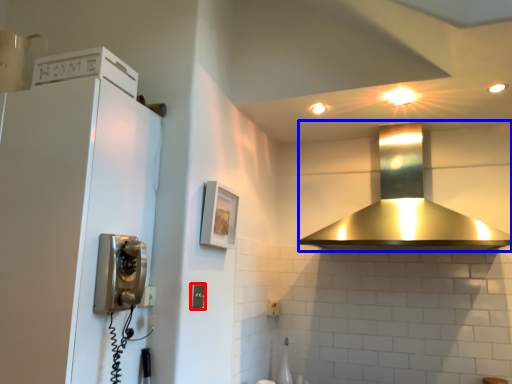
Question: Which object appears farthest to the camera in this image, light switch (highlighted by a red box) or home appliance (highlighted by a blue box)?

Choices:
 (A) light switch
 (B) home appliance

Answer: (A)